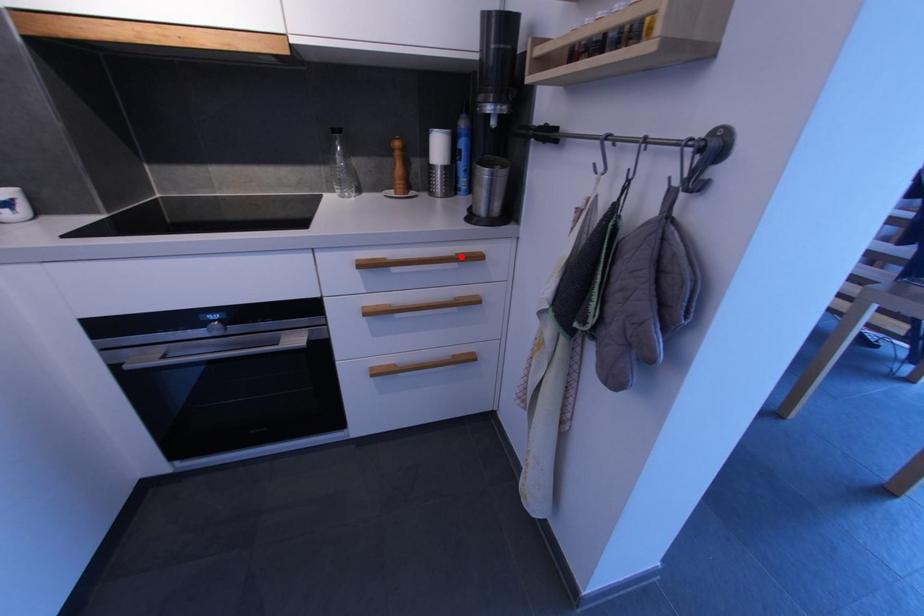
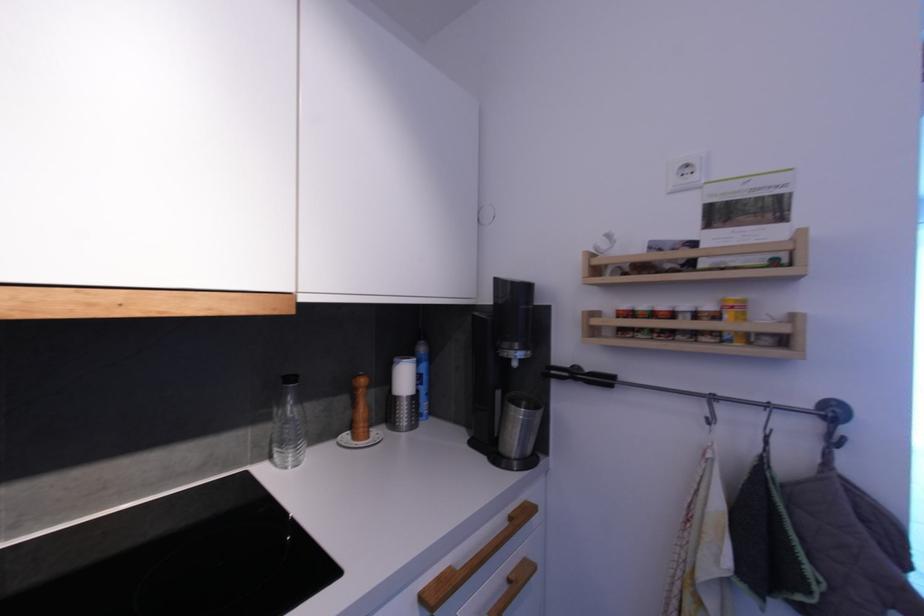
Find the pixel in the second image that matches the highlighted location in the first image.

(516, 519)